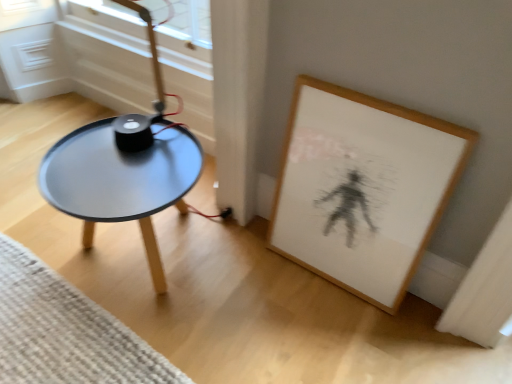
Question: Is wooden framed artwork at lower right not near matte black table at left?

Choices:
 (A) no
 (B) yes

Answer: (A)

Question: Is wooden framed artwork at lower right with matte black table at left?

Choices:
 (A) no
 (B) yes

Answer: (A)

Question: Is matte black table at left surrounded by wooden framed artwork at lower right?

Choices:
 (A) no
 (B) yes

Answer: (A)

Question: Can you confirm if wooden framed artwork at lower right is wider than matte black table at left?

Choices:
 (A) no
 (B) yes

Answer: (A)

Question: Is wooden framed artwork at lower right shorter than matte black table at left?

Choices:
 (A) yes
 (B) no

Answer: (B)

Question: In terms of size, does wooden framed artwork at lower right appear bigger or smaller than woven beige mat at lower left?

Choices:
 (A) big
 (B) small

Answer: (A)

Question: In the image, is wooden framed artwork at lower right on the left side or the right side of woven beige mat at lower left?

Choices:
 (A) right
 (B) left

Answer: (A)

Question: From the image's perspective, is wooden framed artwork at lower right located above or below woven beige mat at lower left?

Choices:
 (A) below
 (B) above

Answer: (B)

Question: From their relative heights in the image, would you say wooden framed artwork at lower right is taller or shorter than woven beige mat at lower left?

Choices:
 (A) tall
 (B) short

Answer: (A)

Question: Looking at their shapes, would you say woven beige mat at lower left is wider or thinner than wooden framed artwork at lower right?

Choices:
 (A) wide
 (B) thin

Answer: (A)

Question: Looking at the image, does woven beige mat at lower left seem bigger or smaller compared to wooden framed artwork at lower right?

Choices:
 (A) small
 (B) big

Answer: (A)

Question: From their relative heights in the image, would you say woven beige mat at lower left is taller or shorter than wooden framed artwork at lower right?

Choices:
 (A) short
 (B) tall

Answer: (A)

Question: Is woven beige mat at lower left in front of or behind wooden framed artwork at lower right in the image?

Choices:
 (A) behind
 (B) front

Answer: (A)

Question: Does point (178, 208) appear closer or farther from the camera than point (309, 145)?

Choices:
 (A) farther
 (B) closer

Answer: (A)

Question: From their relative heights in the image, would you say matte black table at left is taller or shorter than wooden framed artwork at lower right?

Choices:
 (A) tall
 (B) short

Answer: (B)